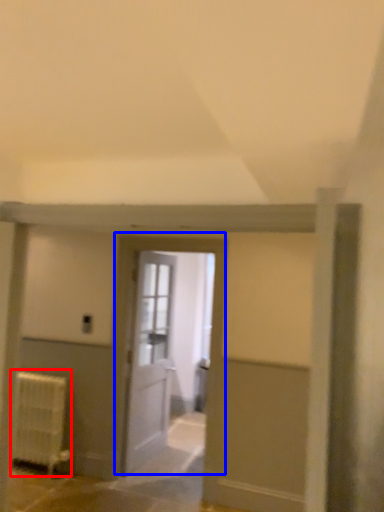
Question: Which of the following is the farthest to the observer, radiator (highlighted by a red box) or door (highlighted by a blue box)?

Choices:
 (A) radiator
 (B) door

Answer: (A)